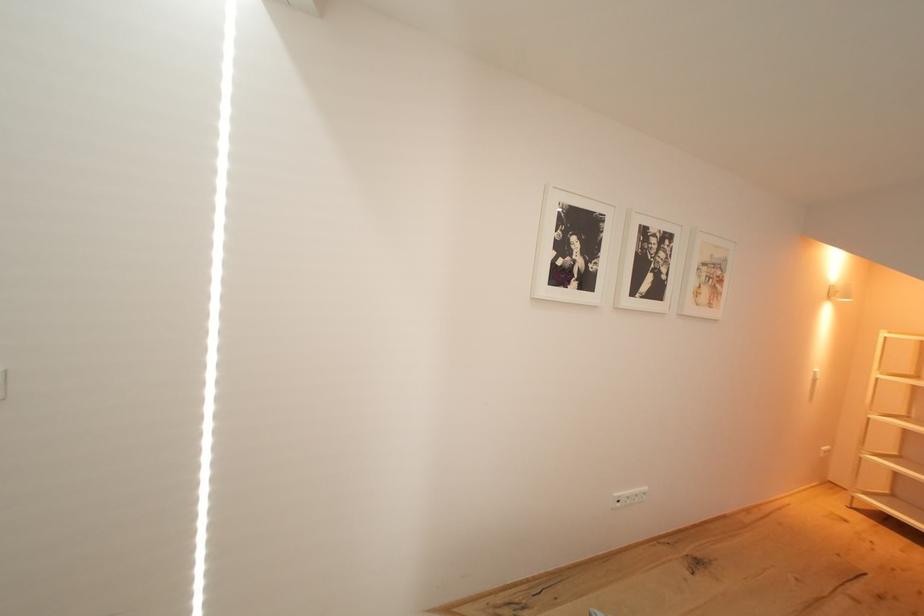
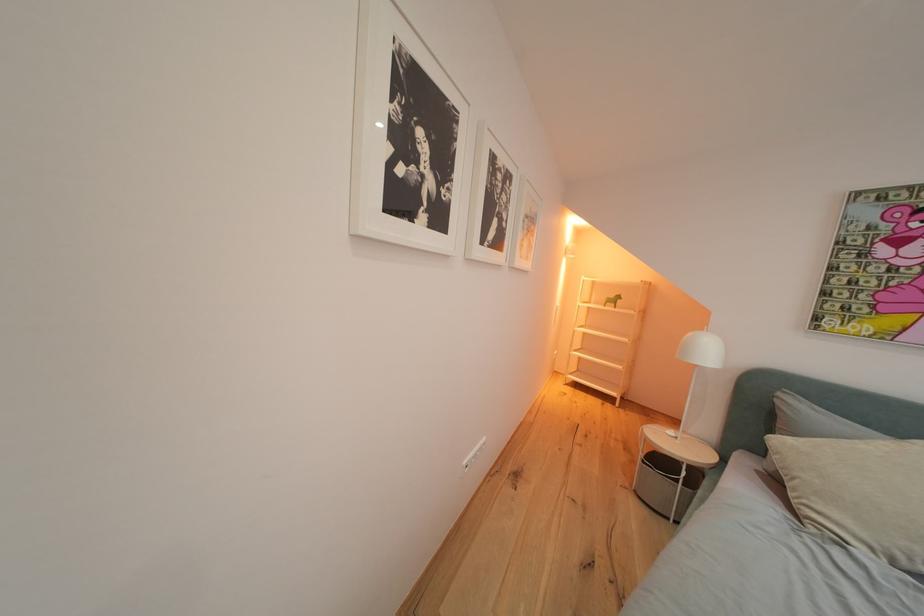
Question: The camera is either moving clockwise (left) or counter-clockwise (right) around the object. The first image is from the beginning of the video and the second image is from the end. Is the camera moving left or right when shooting the video?

Choices:
 (A) Left
 (B) Right

Answer: (A)